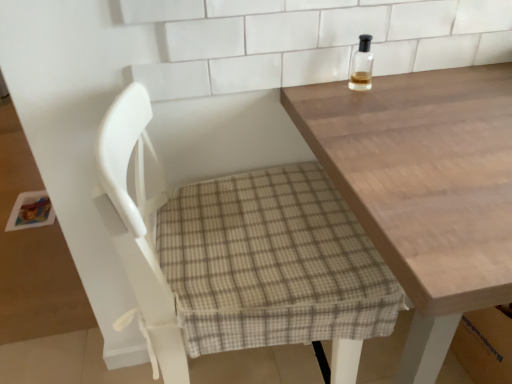
Question: Should I look upward or downward to see white fabric chair at center?

Choices:
 (A) down
 (B) up

Answer: (A)

Question: Can you confirm if white fabric chair at center is positioned to the left of clear glass bottle at upper right?

Choices:
 (A) yes
 (B) no

Answer: (A)

Question: Considering the relative sizes of white fabric chair at center and clear glass bottle at upper right in the image provided, is white fabric chair at center smaller than clear glass bottle at upper right?

Choices:
 (A) yes
 (B) no

Answer: (B)

Question: Is white fabric chair at center positioned behind clear glass bottle at upper right?

Choices:
 (A) no
 (B) yes

Answer: (A)

Question: From a real-world perspective, is white fabric chair at center physically above clear glass bottle at upper right?

Choices:
 (A) yes
 (B) no

Answer: (B)

Question: Is white fabric chair at center next to clear glass bottle at upper right?

Choices:
 (A) yes
 (B) no

Answer: (B)

Question: Is white fabric chair at center completely or partially outside of clear glass bottle at upper right?

Choices:
 (A) yes
 (B) no

Answer: (A)

Question: Is white fabric chair at center at the back of clear glass bottle at upper right?

Choices:
 (A) yes
 (B) no

Answer: (B)

Question: Does clear glass bottle at upper right turn towards white fabric chair at center?

Choices:
 (A) no
 (B) yes

Answer: (A)

Question: From the image's perspective, is clear glass bottle at upper right over white fabric chair at center?

Choices:
 (A) yes
 (B) no

Answer: (A)

Question: Does clear glass bottle at upper right contain white fabric chair at center?

Choices:
 (A) yes
 (B) no

Answer: (B)

Question: Is clear glass bottle at upper right far from white fabric chair at center?

Choices:
 (A) yes
 (B) no

Answer: (B)

Question: Can you confirm if clear glass bottle at upper right is taller than white fabric chair at center?

Choices:
 (A) no
 (B) yes

Answer: (A)

Question: Could light brown wooden table at upper right be considered to be inside white fabric chair at center?

Choices:
 (A) no
 (B) yes

Answer: (A)